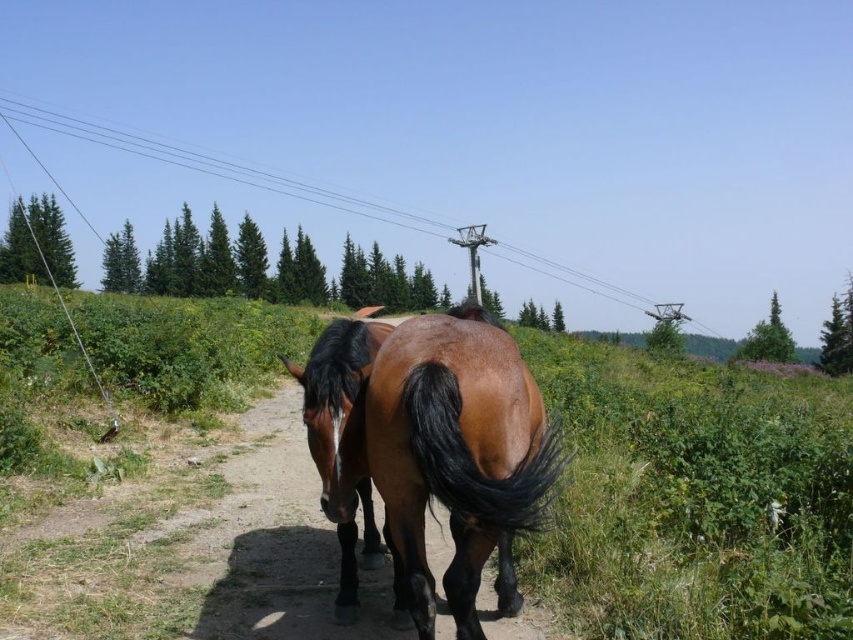
Looking at this image, you are a photographer standing on the dirt path. You want to take a photo of the brown glossy horse at center and brown glossy tail at center. The camera you are using has a maximum focus range of 9 inches. Will you be able to capture both subjects in focus without adjusting your position?

The distance between the brown glossy horse at center and brown glossy tail at center is 9.20 inches. Since the camera can only focus up to 9 inches, the subjects are slightly out of the focus range. You might need to adjust your position or use a different camera setting to ensure both are in focus.

You are a photographer standing on the dirt path. You want to take a picture of both the brown glossy horse at center and the brown glossy tail at center. Which horse should you focus on first if you want to capture both in the frame?

The brown glossy horse at center is to the left of brown glossy tail at center. Since they are positioned close together, focusing on the brown glossy horse at center first will ensure both are in the frame as they are adjacent to each other.